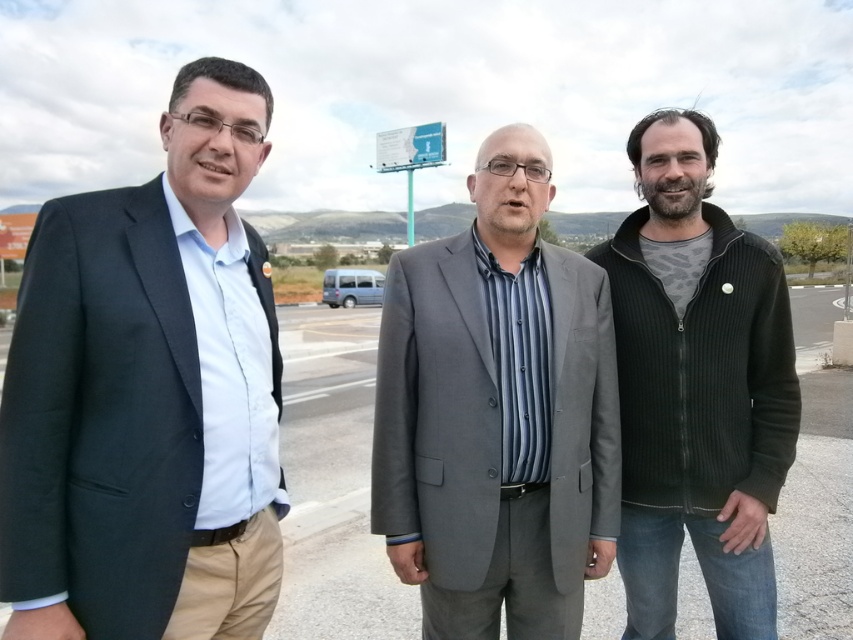
Is point (143, 528) positioned after point (759, 522)?

No, (143, 528) is closer to viewer.

Is matte black suit at left positioned at the back of ribbed fleece jacket at right?

No.

The width and height of the screenshot is (853, 640). What do you see at coordinates (146, 388) in the screenshot?
I see `matte black suit at left` at bounding box center [146, 388].

Where is `matte black suit at left`? The width and height of the screenshot is (853, 640). matte black suit at left is located at coordinates coord(146,388).

Between gray suit at center and ribbed fleece jacket at right, which one appears on the left side from the viewer's perspective?

From the viewer's perspective, gray suit at center appears more on the left side.

What do you see at coordinates (497, 413) in the screenshot? I see `gray suit at center` at bounding box center [497, 413].

This screenshot has height=640, width=853. I want to click on gray suit at center, so [497, 413].

Between point (201, 189) and point (442, 161), which one is positioned in front?

Point (201, 189) is in front.

Does matte black suit at left have a lesser width compared to white plastic billboard at center?

Yes, matte black suit at left is thinner than white plastic billboard at center.

What do you see at coordinates (146, 388) in the screenshot? This screenshot has width=853, height=640. I see `matte black suit at left` at bounding box center [146, 388].

Where is `matte black suit at left`? This screenshot has width=853, height=640. matte black suit at left is located at coordinates (146, 388).